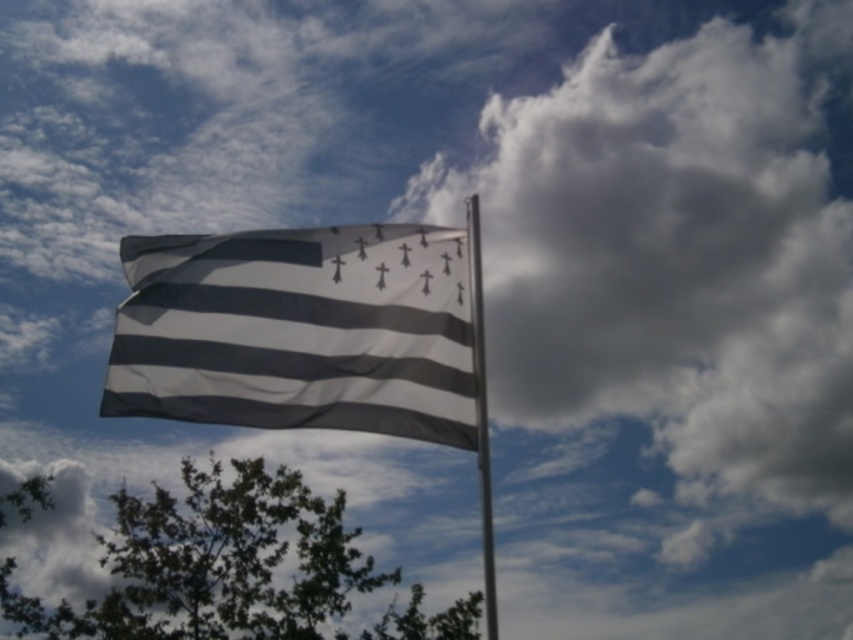
Question: Among these points, which one is farthest from the camera?

Choices:
 (A) (473, 340)
 (B) (407, 618)
 (C) (219, 250)

Answer: (B)

Question: Considering the real-world distances, which object is closest to the black and white striped flag at center?

Choices:
 (A) metallic pole at center
 (B) green leafy tree at lower left

Answer: (A)

Question: Can you confirm if black and white striped flag at center is positioned to the left of green leafy tree at lower left?

Choices:
 (A) no
 (B) yes

Answer: (A)

Question: Based on their relative distances, which object is farther from the green leafy tree at lower left?

Choices:
 (A) metallic pole at center
 (B) black and white striped flag at center

Answer: (A)

Question: In this image, where is black and white striped flag at center located relative to metallic pole at center?

Choices:
 (A) right
 (B) left

Answer: (B)

Question: Can you confirm if black and white striped flag at center is wider than green leafy tree at lower left?

Choices:
 (A) yes
 (B) no

Answer: (A)